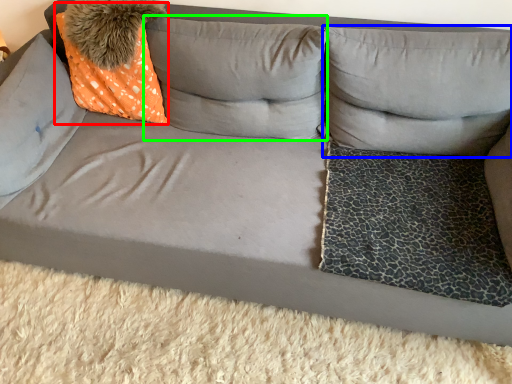
Question: Estimate the real-world distances between objects in this image. Which object is farther from throw pillow (highlighted by a red box), pillow (highlighted by a blue box) or pillow (highlighted by a green box)?

Choices:
 (A) pillow
 (B) pillow

Answer: (A)